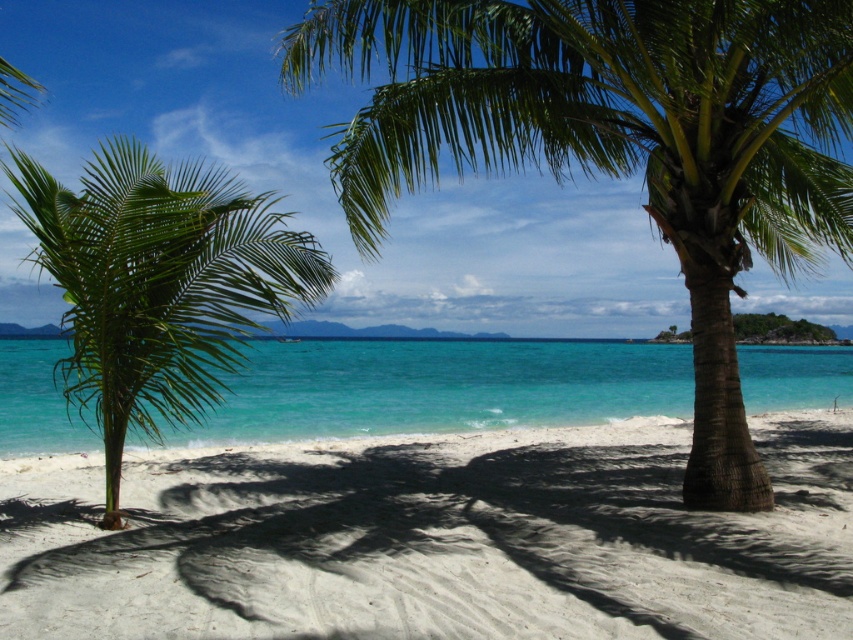
Question: Can you confirm if green leafy palm tree at center is positioned below turquoise glossy water at center?

Choices:
 (A) yes
 (B) no

Answer: (B)

Question: Is green leafy palm tree at center positioned at the back of green leafy palm tree at left?

Choices:
 (A) no
 (B) yes

Answer: (B)

Question: Which point appears closest to the camera in this image?

Choices:
 (A) (68, 552)
 (B) (730, 99)
 (C) (346, 394)
 (D) (234, 224)

Answer: (A)

Question: Which point is closer to the camera?

Choices:
 (A) (109, 355)
 (B) (643, 141)
 (C) (90, 589)
 (D) (412, 426)

Answer: (C)

Question: Estimate the real-world distances between objects in this image. Which object is closer to the green leafy palm tree at left?

Choices:
 (A) turquoise glossy water at center
 (B) white sandy beach at center
 (C) green leafy palm tree at center

Answer: (B)

Question: Is white sandy beach at center wider than turquoise glossy water at center?

Choices:
 (A) yes
 (B) no

Answer: (B)